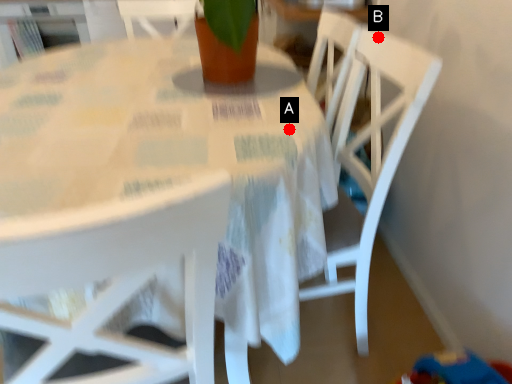
Question: Two points are circled on the image, labeled by A and B beside each circle. Which of the following is the farthest from the observer?

Choices:
 (A) A is further
 (B) B is further

Answer: (B)